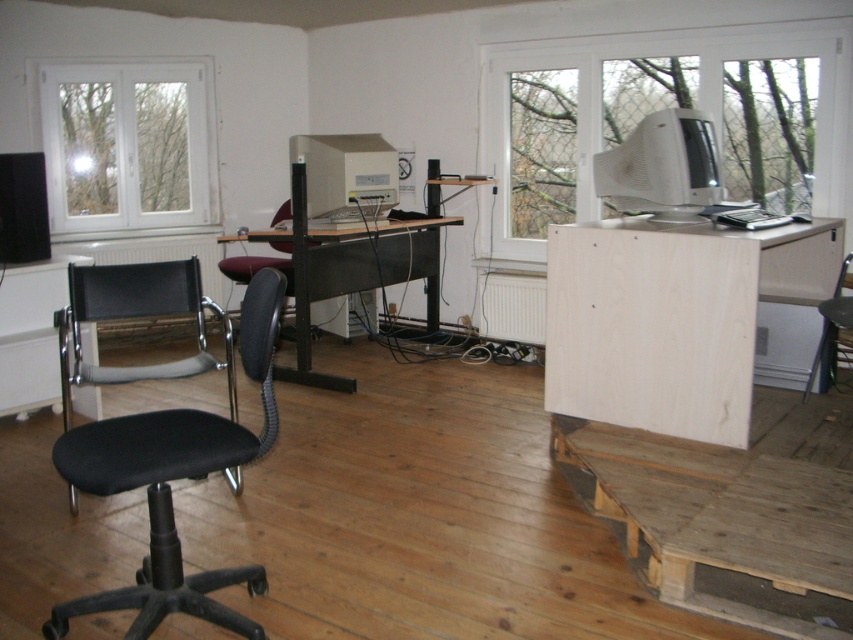
Question: Is transparent glass monitor at right smaller than white glossy computer monitor at upper right?

Choices:
 (A) yes
 (B) no

Answer: (B)

Question: Among these objects, which one is nearest to the camera?

Choices:
 (A) black fabric chair at lower right
 (B) matte black keyboard at right
 (C) metallic black desk at center
 (D) transparent glass monitor at right

Answer: (B)

Question: Which of the following is the closest to the observer?

Choices:
 (A) (721, 140)
 (B) (386, 163)
 (C) (750, 205)
 (D) (610, 490)

Answer: (D)

Question: Does white plastic desktop computer at center appear under black fabric chair at lower right?

Choices:
 (A) no
 (B) yes

Answer: (A)

Question: Does plywood desk at right appear over metallic black desk at center?

Choices:
 (A) yes
 (B) no

Answer: (B)

Question: Which is nearer to the black fabric chair at lower right?

Choices:
 (A) plywood desk at right
 (B) white glossy computer monitor at upper right

Answer: (A)